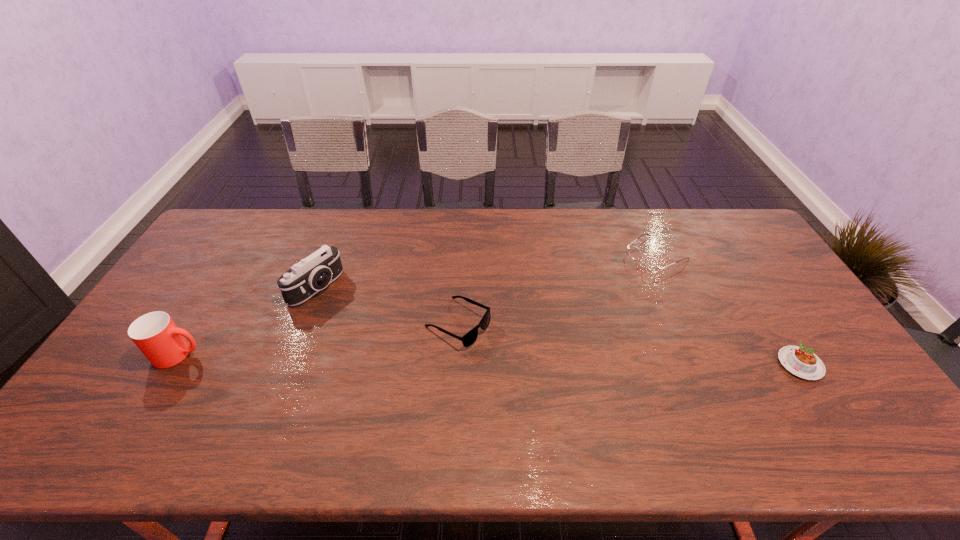
Locate an element on the screen. The height and width of the screenshot is (540, 960). cup is located at coordinates (156, 335).

You are a GUI agent. You are given a task and a screenshot of the screen. Output one action in this format:
    pyautogui.click(x=<x>, y=<y>)
    Task: Click on the rightmost object
    
    Given the screenshot: What is the action you would take?
    pyautogui.click(x=802, y=362)

Find the location of a particular element. Image resolution: width=960 pixels, height=540 pixels. the shortest object is located at coordinates (802, 362).

At what (x,y) coordinates should I click in order to perform the action: click on the fourth object from left to right. Please return your answer as a coordinate pair (x, y). The image size is (960, 540). Looking at the image, I should click on pos(651,263).

Where is `sunglasses`? The height and width of the screenshot is (540, 960). sunglasses is located at coordinates [468, 339].

The width and height of the screenshot is (960, 540). Identify the location of the fourth object from right to left. (314, 273).

Find the location of a particular element. free spot located 0.100m on the side of the leftmost object with the handle is located at coordinates (240, 355).

Locate an element on the screen. The height and width of the screenshot is (540, 960). vacant space located on the front of the pudding is located at coordinates (827, 406).

What are the coordinates of `free space located 0.260m through the lenses of the spectacles` in the screenshot? It's located at (582, 300).

Image resolution: width=960 pixels, height=540 pixels. Find the location of `free point located through the lenses of the spectacles`. free point located through the lenses of the spectacles is located at coordinates (590, 295).